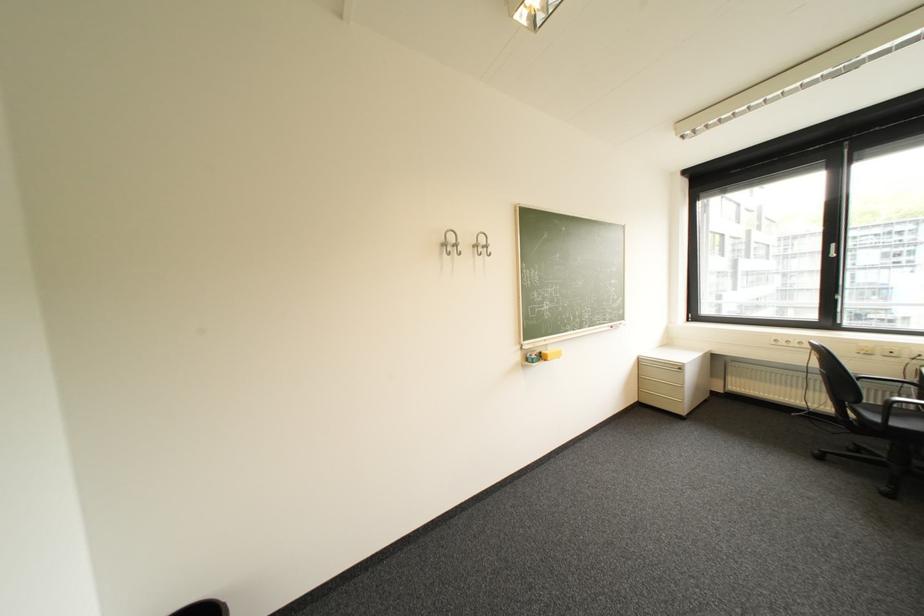
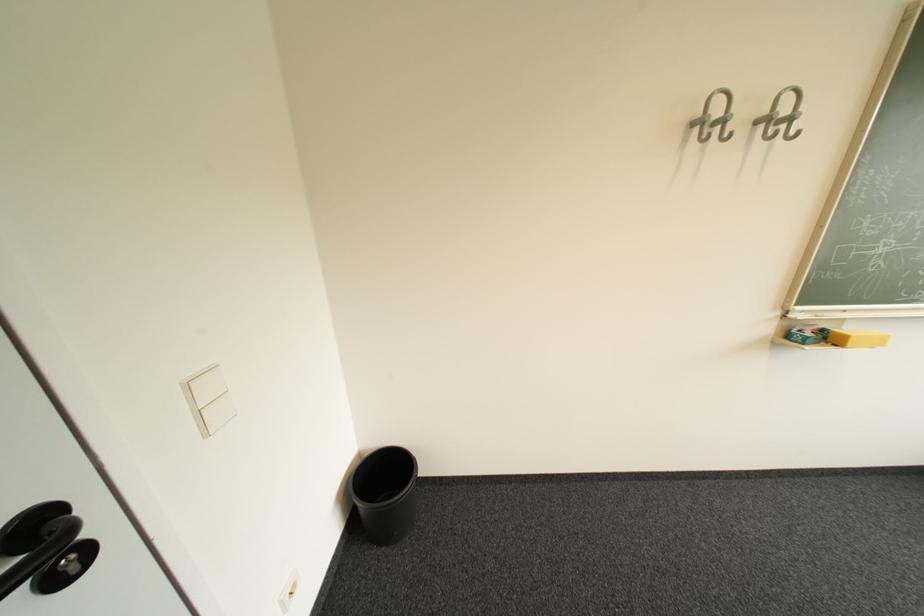
The point at (555,361) is marked in the first image. Where is the corresponding point in the second image?

(846, 346)